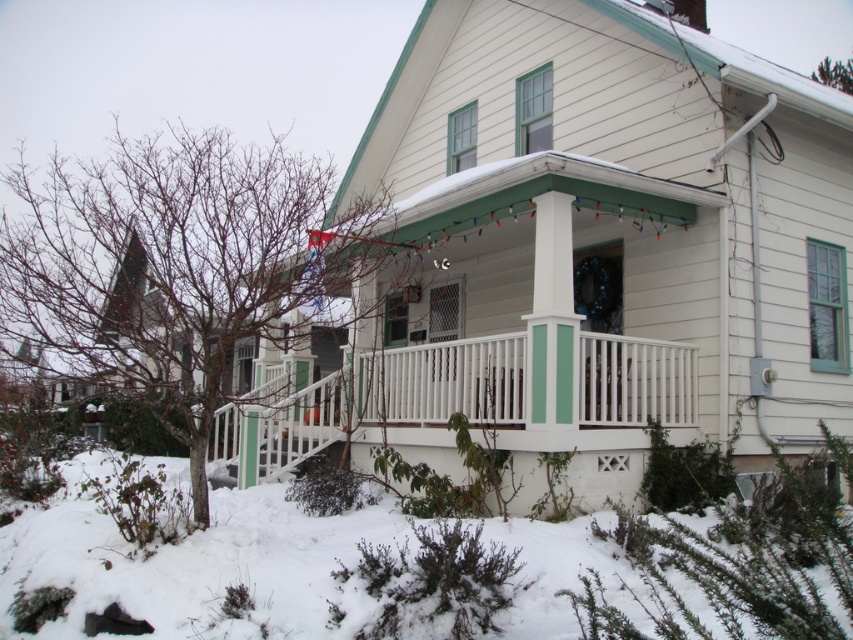
Is point (241, 634) farther from viewer compared to point (410, 372)?

No, it is not.

The width and height of the screenshot is (853, 640). What do you see at coordinates (440, 573) in the screenshot?
I see `white fluffy snow at lower left` at bounding box center [440, 573].

Describe the element at coordinates (440, 573) in the screenshot. I see `white fluffy snow at lower left` at that location.

The image size is (853, 640). What are the coordinates of `white fluffy snow at lower left` in the screenshot? It's located at (440, 573).